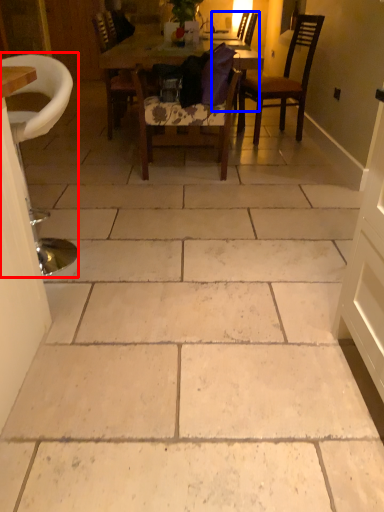
Question: Among these objects, which one is nearest to the camera, chair (highlighted by a red box) or chair (highlighted by a blue box)?

Choices:
 (A) chair
 (B) chair

Answer: (A)